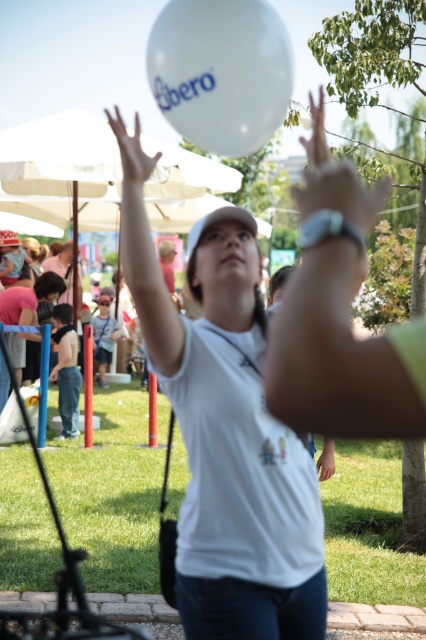
From the picture: Can you confirm if white matte balloon at center is bigger than white matte balloon at upper center?

Correct, white matte balloon at center is larger in size than white matte balloon at upper center.

Based on the photo, who is taller, white matte balloon at center or white matte balloon at upper center?

white matte balloon at center

Find the location of a particular element. Image resolution: width=426 pixels, height=640 pixels. white matte balloon at center is located at coordinates (229, 442).

Can you confirm if white matte balloon at center is wider than matte pink shirt at lower left?

No.

Does point (273, 636) come closer to viewer compared to point (28, 337)?

That is True.

The height and width of the screenshot is (640, 426). What are the coordinates of `white matte balloon at center` in the screenshot? It's located at (229, 442).

The width and height of the screenshot is (426, 640). I want to click on matte pink shirt at lower left, so click(x=28, y=300).

Is matte pink shirt at lower left above white matte balloon at upper center?

No.

Locate an element on the screen. The height and width of the screenshot is (640, 426). matte pink shirt at lower left is located at coordinates (28, 300).